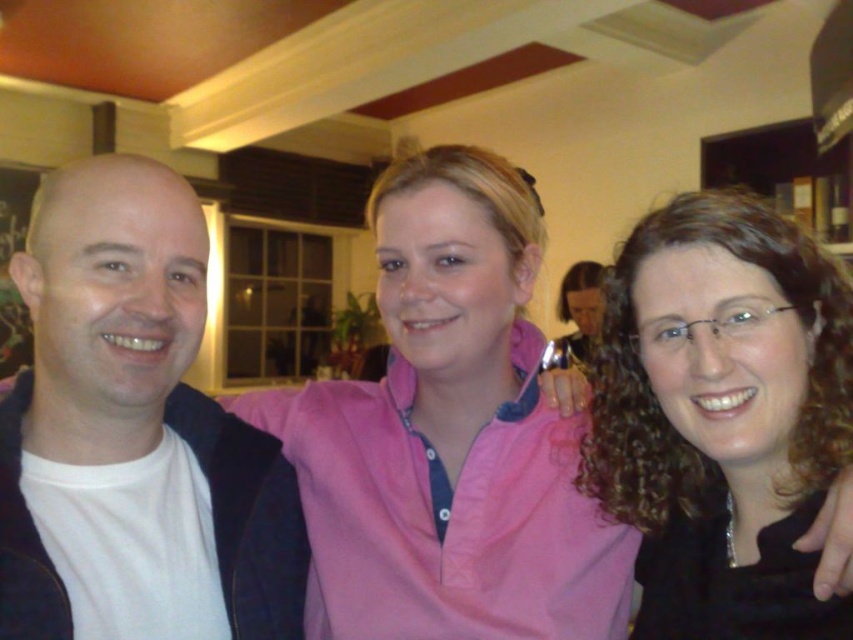
Does white matte t-shirt at left appear over curly brown hair at center?

Indeed, white matte t-shirt at left is positioned over curly brown hair at center.

Is the position of white matte t-shirt at left less distant than that of curly brown hair at center?

No, it is not.

Who is more distant from viewer, (198, 285) or (606, 291)?

Positioned behind is point (606, 291).

The height and width of the screenshot is (640, 853). I want to click on white matte t-shirt at left, so click(x=132, y=433).

Can you confirm if pink cotton shirt at center is smaller than curly brown hair at center?

Actually, pink cotton shirt at center might be larger than curly brown hair at center.

Can you confirm if pink cotton shirt at center is positioned above curly brown hair at center?

Indeed, pink cotton shirt at center is positioned over curly brown hair at center.

Who is more forward, [308,609] or [729,621]?

Point [729,621] is more forward.

I want to click on pink cotton shirt at center, so click(x=450, y=436).

From the picture: Does pink cotton shirt at center have a lesser height compared to white matte t-shirt at left?

No.

Who is positioned more to the right, pink cotton shirt at center or white matte t-shirt at left?

pink cotton shirt at center

At what (x,y) coordinates should I click in order to perform the action: click on pink cotton shirt at center. Please return your answer as a coordinate pair (x, y). The width and height of the screenshot is (853, 640). Looking at the image, I should click on (450, 436).